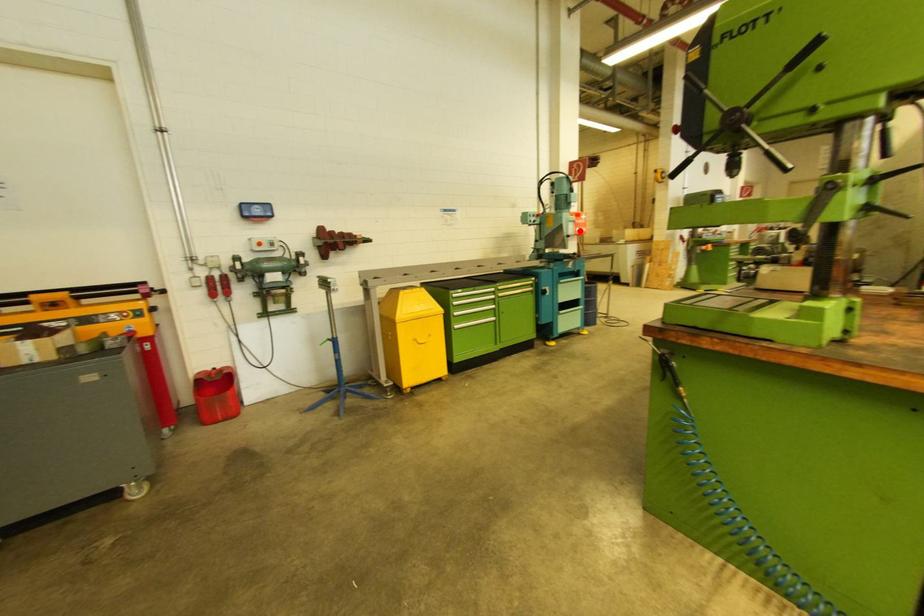
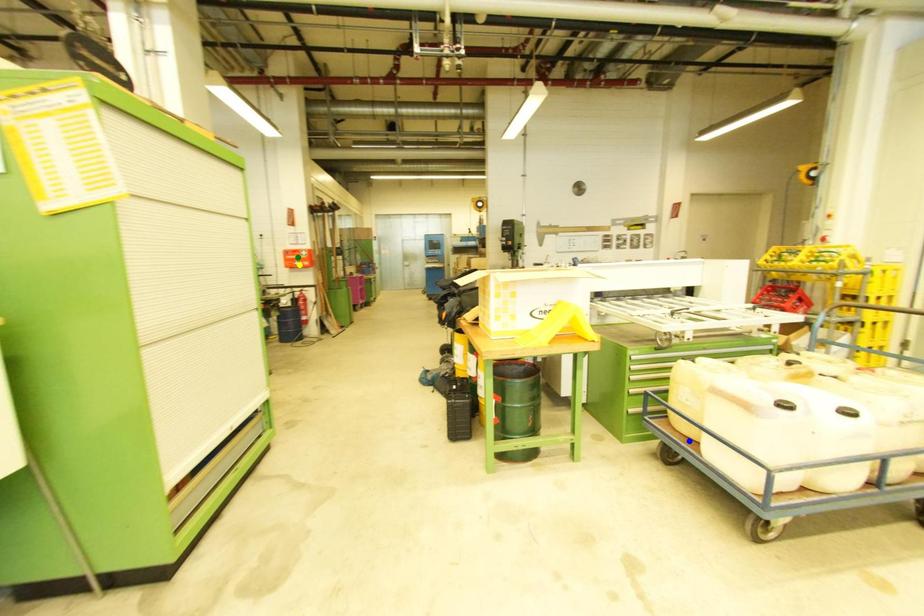
Question: I am providing you with two images of the same scene from different viewpoints. A red point is marked on the first image. You are given multiple points on the second image. Which spot in image 2 lines up with the point in image 1?

Choices:
 (A) green point
 (B) yellow point
 (C) blue point

Answer: (B)